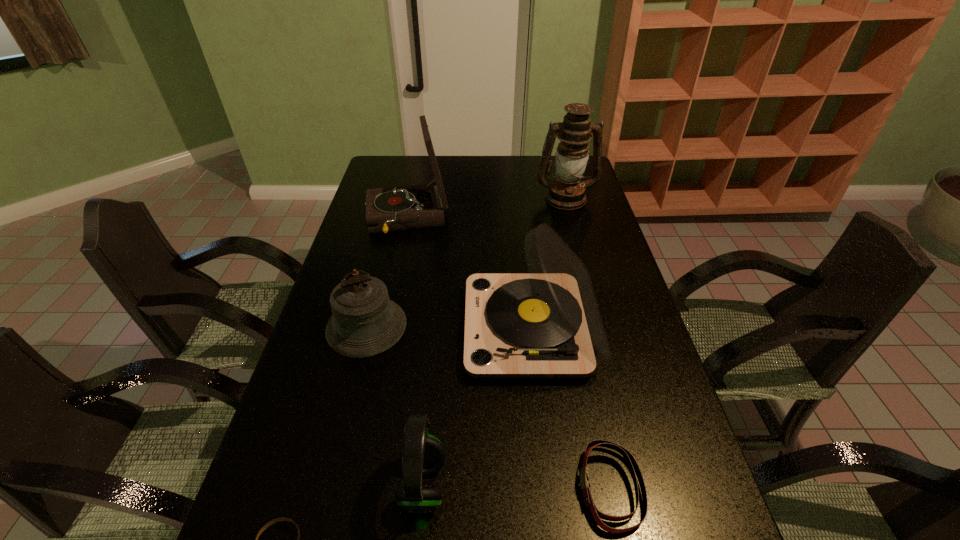
Locate an element on the screen. Image resolution: width=960 pixels, height=540 pixels. lantern is located at coordinates point(567,192).

Image resolution: width=960 pixels, height=540 pixels. In order to click on phonograph record in this screenshot , I will do `click(415, 206)`.

This screenshot has height=540, width=960. What are the coordinates of `the fifth shortest object` in the screenshot? It's located at pyautogui.click(x=546, y=324).

Identify the location of bell. (365, 322).

Find the location of a particular element. The image size is (960, 540). headset is located at coordinates (422, 454).

The height and width of the screenshot is (540, 960). I want to click on dog collar, so click(x=631, y=462).

Image resolution: width=960 pixels, height=540 pixels. In order to click on vacant space positioned 0.330m on the left of the lantern in this screenshot , I will do `click(449, 198)`.

Where is `vacant space located on the front of the phonograph record`? The height and width of the screenshot is (540, 960). vacant space located on the front of the phonograph record is located at coordinates (390, 299).

I want to click on vacant space located with the tonearm facing the front of the record player, so click(407, 328).

This screenshot has width=960, height=540. I want to click on free location located with the tonearm facing the front of the record player, so click(x=346, y=328).